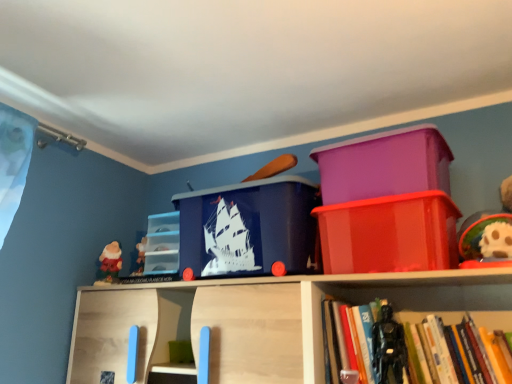
Find the location of a particular element. Image resolution: width=512 pixels, height=384 pixels. glossy plastic container at upper right, which is counted as the 1th storage box, starting from the right is located at coordinates (389, 234).

The height and width of the screenshot is (384, 512). Describe the element at coordinates (389, 234) in the screenshot. I see `glossy plastic container at upper right, the fourth storage box in the left-to-right sequence` at that location.

What do you see at coordinates (162, 244) in the screenshot?
I see `transparent plastic storage box at center, which is the first storage box from left to right` at bounding box center [162, 244].

Describe the element at coordinates (109, 263) in the screenshot. The height and width of the screenshot is (384, 512). I see `red velvet santa at left, which ranks as the second toy in front-to-back order` at that location.

Where is `blue plastic storage box at center, which is the third storage box from right to left`? blue plastic storage box at center, which is the third storage box from right to left is located at coordinates (247, 227).

Identify the location of glossy plastic container at upper right, the fourth storage box in the left-to-right sequence. (389, 234).

Looking at this image, based on their positions, is purple plastic container at upper right, the 3th storage box when ordered from left to right, located to the left or right of glossy plastic container at upper right, which is counted as the 1th storage box, starting from the right?

purple plastic container at upper right, the 3th storage box when ordered from left to right, is to the left of glossy plastic container at upper right, which is counted as the 1th storage box, starting from the right.

Considering the sizes of purple plastic container at upper right, the second storage box positioned from the right, and glossy plastic container at upper right, which is counted as the 1th storage box, starting from the right, in the image, is purple plastic container at upper right, the second storage box positioned from the right, taller or shorter than glossy plastic container at upper right, which is counted as the 1th storage box, starting from the right,?

purple plastic container at upper right, the second storage box positioned from the right, is shorter than glossy plastic container at upper right, which is counted as the 1th storage box, starting from the right.

Does purple plastic container at upper right, the 3th storage box when ordered from left to right, have a larger size compared to glossy plastic container at upper right, the fourth storage box in the left-to-right sequence?

No.

Is the surface of purple plastic container at upper right, the 3th storage box when ordered from left to right, in direct contact with glossy plastic container at upper right, the fourth storage box in the left-to-right sequence?

No, purple plastic container at upper right, the 3th storage box when ordered from left to right, is not next to glossy plastic container at upper right, the fourth storage box in the left-to-right sequence.

Between red velvet santa at left, arranged as the 2th toy when viewed from the right, and purple plastic container at upper right, the second storage box positioned from the right, which one has less height?

Standing shorter between the two is red velvet santa at left, arranged as the 2th toy when viewed from the right.

Is red velvet santa at left, arranged as the 2th toy when viewed from the right, at the left side of purple plastic container at upper right, the 3th storage box when ordered from left to right?

Yes, red velvet santa at left, arranged as the 2th toy when viewed from the right, is to the left of purple plastic container at upper right, the 3th storage box when ordered from left to right.

Which point is more distant from viewer, (120,246) or (432,130)?

Point (120,246)

Which of these two, hardcover book at lower right or glossy plastic container at upper right, the fourth storage box in the left-to-right sequence, stands taller?

hardcover book at lower right is taller.

Based on the photo, is hardcover book at lower right closer to camera compared to glossy plastic container at upper right, the fourth storage box in the left-to-right sequence?

Yes, it is in front of glossy plastic container at upper right, the fourth storage box in the left-to-right sequence.

How distant is hardcover book at lower right from glossy plastic container at upper right, which is counted as the 1th storage box, starting from the right?

9.53 inches.

Considering the sizes of hardcover book at lower right and glossy plastic container at upper right, which is counted as the 1th storage box, starting from the right, in the image, is hardcover book at lower right bigger or smaller than glossy plastic container at upper right, which is counted as the 1th storage box, starting from the right,?

Clearly, hardcover book at lower right is smaller in size than glossy plastic container at upper right, which is counted as the 1th storage box, starting from the right.

Could you tell me if purple plastic container at upper right, the 3th storage box when ordered from left to right, is facing black plastic toy at center-right, the first toy in the front-to-back sequence?

No.

Does point (419, 134) lie behind point (382, 329)?

Yes.

Is purple plastic container at upper right, the 3th storage box when ordered from left to right, wider than black plastic toy at center-right, the first toy positioned from the right?

Correct, the width of purple plastic container at upper right, the 3th storage box when ordered from left to right, exceeds that of black plastic toy at center-right, the first toy positioned from the right.

Between purple plastic container at upper right, the 3th storage box when ordered from left to right, and black plastic toy at center-right, the 2th toy positioned from the back, which one is positioned in front?

black plastic toy at center-right, the 2th toy positioned from the back, is more forward.

In the scene shown: From the image's perspective, which one is positioned lower, red velvet santa at left, arranged as the 2th toy when viewed from the right, or glossy plastic container at upper right, which is counted as the 1th storage box, starting from the right?

red velvet santa at left, arranged as the 2th toy when viewed from the right, from the image's perspective.

Can you tell me how much red velvet santa at left, the first toy viewed from the left, and glossy plastic container at upper right, the fourth storage box in the left-to-right sequence, differ in facing direction?

There is a 24.9-degree angle between the facing directions of red velvet santa at left, the first toy viewed from the left, and glossy plastic container at upper right, the fourth storage box in the left-to-right sequence.

Which point is more distant from viewer, (x=113, y=253) or (x=433, y=231)?

The point (x=113, y=253) is behind.

You are a GUI agent. You are given a task and a screenshot of the screen. Output one action in this format:
    pyautogui.click(x=<x>, y=<y>)
    Task: Click on the 1st storage box above the red velvet santa at left, arranged as the 2th toy when viewed from the right (from a real-world perspective)
    This screenshot has height=384, width=512.
    Given the screenshot: What is the action you would take?
    pos(389,234)

Considering the relative sizes of blue plastic storage box at center, arranged as the 2th storage box when viewed from the left, and purple plastic container at upper right, the second storage box positioned from the right, in the image provided, is blue plastic storage box at center, arranged as the 2th storage box when viewed from the left, bigger than purple plastic container at upper right, the second storage box positioned from the right,?

Yes, blue plastic storage box at center, arranged as the 2th storage box when viewed from the left, is bigger than purple plastic container at upper right, the second storage box positioned from the right.

Is blue plastic storage box at center, which is the third storage box from right to left, completely or partially outside of purple plastic container at upper right, the 3th storage box when ordered from left to right?

Yes.

Can you confirm if blue plastic storage box at center, arranged as the 2th storage box when viewed from the left, is shorter than purple plastic container at upper right, the second storage box positioned from the right?

Incorrect, the height of blue plastic storage box at center, arranged as the 2th storage box when viewed from the left, does not fall short of that of purple plastic container at upper right, the second storage box positioned from the right.

From a real-world perspective, which object stands above the other?

From a 3D spatial view, purple plastic container at upper right, the second storage box positioned from the right, is above.

Who is taller, glossy plastic container at upper right, which is counted as the 1th storage box, starting from the right, or black plastic toy at center-right, the 2th toy in the left-to-right sequence?

With more height is black plastic toy at center-right, the 2th toy in the left-to-right sequence.

Visually, is glossy plastic container at upper right, which is counted as the 1th storage box, starting from the right, positioned to the left or to the right of black plastic toy at center-right, the first toy positioned from the right?

In the image, glossy plastic container at upper right, which is counted as the 1th storage box, starting from the right, appears on the right side of black plastic toy at center-right, the first toy positioned from the right.

From the image's perspective, which is above, glossy plastic container at upper right, the fourth storage box in the left-to-right sequence, or black plastic toy at center-right, the first toy positioned from the right?

glossy plastic container at upper right, the fourth storage box in the left-to-right sequence, appears higher in the image.

What are the coordinates of `the 3rd storage box positioned below the purple plastic container at upper right, the second storage box positioned from the right (from a real-world perspective)` in the screenshot? It's located at (389, 234).

Starting from the purple plastic container at upper right, the second storage box positioned from the right, which toy is the 2nd one to the left? Please provide its 2D coordinates.

[(109, 263)]

Looking at the image, which one is located closer to hardcover book at lower right, black plastic toy at center-right, the first toy positioned from the right, or purple plastic container at upper right, the second storage box positioned from the right?

black plastic toy at center-right, the first toy positioned from the right, lies closer to hardcover book at lower right than the other object.

Considering their positions, is glossy plastic container at upper right, the fourth storage box in the left-to-right sequence, positioned closer to transparent plastic storage box at center, which is the first storage box from left to right, than red velvet santa at left, the 1th toy viewed from the back?

red velvet santa at left, the 1th toy viewed from the back, is positioned closer to the anchor transparent plastic storage box at center, which is the first storage box from left to right.

Based on their spatial positions, is purple plastic container at upper right, the 3th storage box when ordered from left to right, or blue plastic storage box at center, which is the third storage box from right to left, further from red velvet santa at left, the first toy viewed from the left?

purple plastic container at upper right, the 3th storage box when ordered from left to right, is positioned further to the anchor red velvet santa at left, the first toy viewed from the left.

Estimate the real-world distances between objects in this image. Which object is further from blue plastic storage box at center, arranged as the 2th storage box when viewed from the left, glossy plastic container at upper right, the fourth storage box in the left-to-right sequence, or transparent plastic storage box at center, which is the first storage box from left to right?

The object further to blue plastic storage box at center, arranged as the 2th storage box when viewed from the left, is transparent plastic storage box at center, which is the first storage box from left to right.

Considering their positions, is black plastic toy at center-right, the first toy positioned from the right, positioned further to blue plastic storage box at center, arranged as the 2th storage box when viewed from the left, than red velvet santa at left, which ranks as the second toy in front-to-back order?

red velvet santa at left, which ranks as the second toy in front-to-back order, is further to blue plastic storage box at center, arranged as the 2th storage box when viewed from the left.

In the scene shown: From the image, which object appears to be nearer to black plastic toy at center-right, the 2th toy positioned from the back, hardcover book at lower right or purple plastic container at upper right, the second storage box positioned from the right?

hardcover book at lower right.

When comparing their distances from glossy plastic container at upper right, the fourth storage box in the left-to-right sequence, does black plastic toy at center-right, the first toy in the front-to-back sequence, or transparent plastic storage box at center, which ranks as the fourth storage box in right-to-left order, seem further?

The object further to glossy plastic container at upper right, the fourth storage box in the left-to-right sequence, is transparent plastic storage box at center, which ranks as the fourth storage box in right-to-left order.

In the scene shown: When comparing their distances from red velvet santa at left, which ranks as the second toy in front-to-back order, does transparent plastic storage box at center, which is the first storage box from left to right, or purple plastic container at upper right, the 3th storage box when ordered from left to right, seem further?

Based on the image, purple plastic container at upper right, the 3th storage box when ordered from left to right, appears to be further to red velvet santa at left, which ranks as the second toy in front-to-back order.

Locate an element on the screen. The width and height of the screenshot is (512, 384). toy between red velvet santa at left, the first toy viewed from the left, and glossy plastic container at upper right, the fourth storage box in the left-to-right sequence, from left to right is located at coordinates (389, 348).

Where is `storage box situated between blue plastic storage box at center, which is the third storage box from right to left, and glossy plastic container at upper right, which is counted as the 1th storage box, starting from the right, from left to right`? storage box situated between blue plastic storage box at center, which is the third storage box from right to left, and glossy plastic container at upper right, which is counted as the 1th storage box, starting from the right, from left to right is located at coordinates (384, 164).

You are a GUI agent. You are given a task and a screenshot of the screen. Output one action in this format:
    pyautogui.click(x=<x>, y=<y>)
    Task: Click on the storage box situated between transparent plastic storage box at center, which ranks as the fourth storage box in right-to-left order, and black plastic toy at center-right, the 2th toy in the left-to-right sequence, from left to right
    The width and height of the screenshot is (512, 384).
    Given the screenshot: What is the action you would take?
    pyautogui.click(x=247, y=227)

This screenshot has width=512, height=384. Identify the location of toy located between transparent plastic storage box at center, which is the first storage box from left to right, and hardcover book at lower right in the left-right direction. (389, 348).